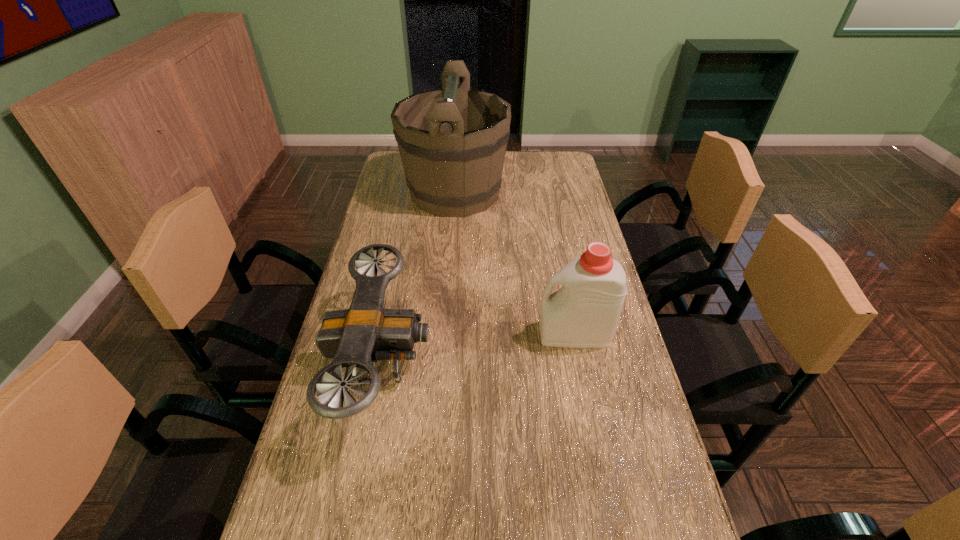
You are a GUI agent. You are given a task and a screenshot of the screen. Output one action in this format:
    pyautogui.click(x=<x>, y=<y>)
    Task: Click on the vacant region between the rightmost object and the tallest object
    
    Given the screenshot: What is the action you would take?
    pyautogui.click(x=515, y=263)

In order to click on unoccupied position between the drone and the bucket in this screenshot , I will do point(419,278).

Where is `unoccupied position between the drone and the rightmost object`? Image resolution: width=960 pixels, height=540 pixels. unoccupied position between the drone and the rightmost object is located at coordinates (478, 348).

This screenshot has height=540, width=960. I want to click on empty space that is in between the detergent and the tallest object, so pyautogui.click(x=515, y=263).

I want to click on the second closest object relative to the shortest object, so click(x=452, y=141).

Identify which object is the second closest to the farthest object. Please provide its 2D coordinates. Your answer should be formatted as a tuple, i.e. [(x, y)], where the tuple contains the x and y coordinates of a point satisfying the conditions above.

[(584, 312)]